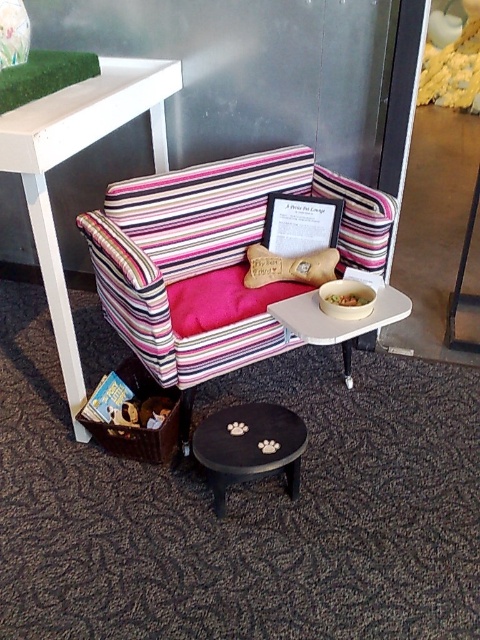
Between black matte side table at lower center and smooth yellow bowl at center, which one has more height?

Standing taller between the two is black matte side table at lower center.

Is black matte side table at lower center taller than smooth yellow bowl at center?

Indeed, black matte side table at lower center has a greater height compared to smooth yellow bowl at center.

Which is behind, point (238, 477) or point (367, 291)?

The point (367, 291) is behind.

Identify the location of black matte side table at lower center. (249, 445).

Does striped fabric couch at center have a lesser height compared to white wood table at upper left?

Indeed, striped fabric couch at center has a lesser height compared to white wood table at upper left.

At what (x,y) coordinates should I click in order to perform the action: click on striped fabric couch at center. Please return your answer as a coordinate pair (x, y). The image size is (480, 640). Looking at the image, I should click on (214, 259).

Is point (57, 291) behind point (370, 300)?

That is False.

Does white wood table at upper left have a larger size compared to smooth yellow bowl at center?

Yes.

Is point (67, 360) farther from camera compared to point (362, 298)?

Yes, it is behind point (362, 298).

Find the location of `white wood table at upper left`. white wood table at upper left is located at coordinates (69, 157).